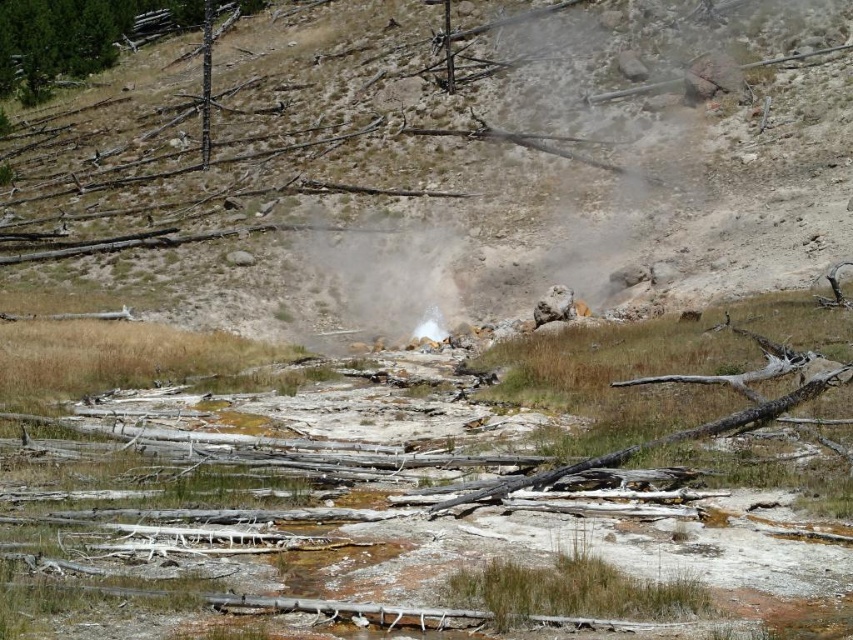
Question: Is white vapor at center above green textured pine tree at upper left?

Choices:
 (A) no
 (B) yes

Answer: (A)

Question: Which of the following is the closest to the observer?

Choices:
 (A) green textured pine tree at upper left
 (B) brown dirt hillside at center
 (C) white vapor at center

Answer: (B)

Question: Which object is farther from the camera taking this photo?

Choices:
 (A) brown dirt hillside at center
 (B) white vapor at center
 (C) green textured pine tree at upper left

Answer: (C)

Question: Which point is closer to the camera?

Choices:
 (A) brown dirt hillside at center
 (B) white vapor at center

Answer: (A)

Question: Does brown dirt hillside at center appear on the right side of green textured pine tree at upper left?

Choices:
 (A) no
 (B) yes

Answer: (B)

Question: Can you confirm if brown dirt hillside at center is smaller than green textured pine tree at upper left?

Choices:
 (A) yes
 (B) no

Answer: (B)